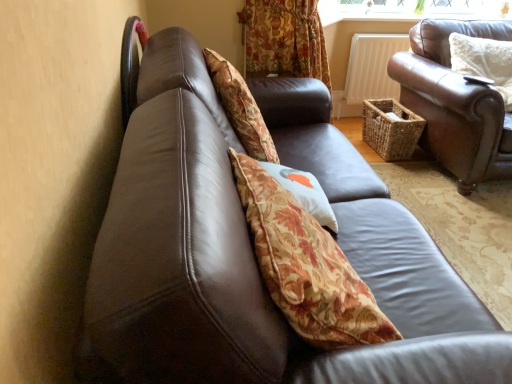
Question: In which direction should I rotate to look at floral fabric cushion at center, the 1th pillow ordered from the bottom?

Choices:
 (A) left
 (B) right

Answer: (B)

Question: Is white fluffy pillow at upper right, which is the 2th pillow from bottom to top, outside brown leather couch at right?

Choices:
 (A) no
 (B) yes

Answer: (A)

Question: From a real-world perspective, is white fluffy pillow at upper right, placed as the 2th pillow when sorted from front to back, on brown leather couch at right?

Choices:
 (A) no
 (B) yes

Answer: (B)

Question: Are white fluffy pillow at upper right, positioned as the 1th pillow in back-to-front order, and brown leather couch at right far apart?

Choices:
 (A) yes
 (B) no

Answer: (B)

Question: Does white fluffy pillow at upper right, the 1th pillow viewed from the top, lie in front of brown leather couch at right?

Choices:
 (A) no
 (B) yes

Answer: (A)

Question: Can you confirm if white fluffy pillow at upper right, positioned as the 1th pillow in back-to-front order, is smaller than brown leather couch at right?

Choices:
 (A) no
 (B) yes

Answer: (B)

Question: Can you confirm if white fluffy pillow at upper right, the 1th pillow viewed from the top, is wider than brown leather couch at right?

Choices:
 (A) yes
 (B) no

Answer: (B)

Question: Can you confirm if brown leather couch at right is thinner than shiny black chair at upper left?

Choices:
 (A) yes
 (B) no

Answer: (B)

Question: Is brown leather couch at right surrounding shiny black chair at upper left?

Choices:
 (A) yes
 (B) no

Answer: (B)

Question: Does brown leather couch at right lie in front of shiny black chair at upper left?

Choices:
 (A) yes
 (B) no

Answer: (B)

Question: From the image's perspective, is brown leather couch at right located above shiny black chair at upper left?

Choices:
 (A) yes
 (B) no

Answer: (B)

Question: Considering the relative sizes of brown leather couch at right and shiny black chair at upper left in the image provided, is brown leather couch at right bigger than shiny black chair at upper left?

Choices:
 (A) no
 (B) yes

Answer: (B)

Question: Does brown leather couch at right have a smaller size compared to shiny black chair at upper left?

Choices:
 (A) yes
 (B) no

Answer: (B)

Question: Is brown leather couch at right positioned behind white fluffy pillow at upper right, positioned as the 1th pillow in back-to-front order?

Choices:
 (A) no
 (B) yes

Answer: (A)